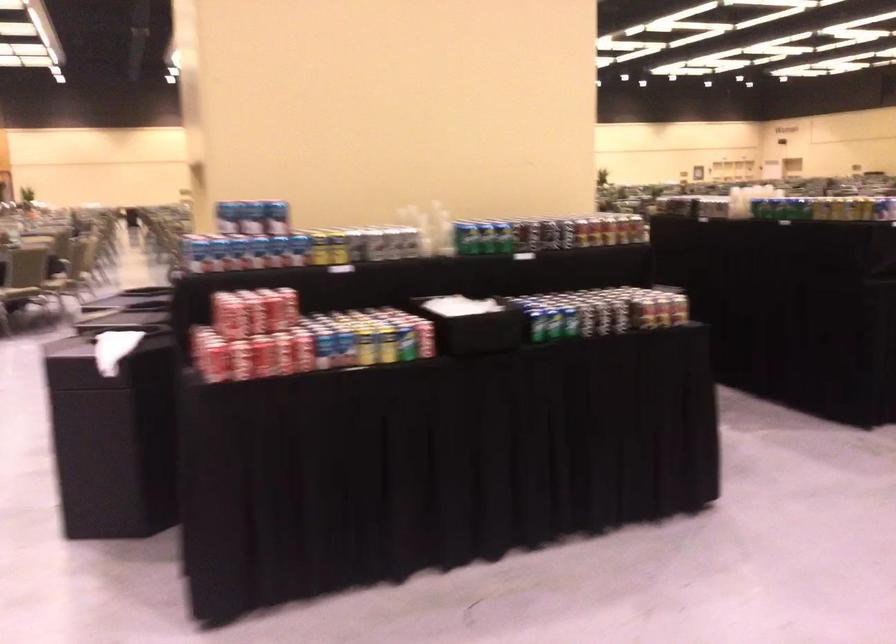
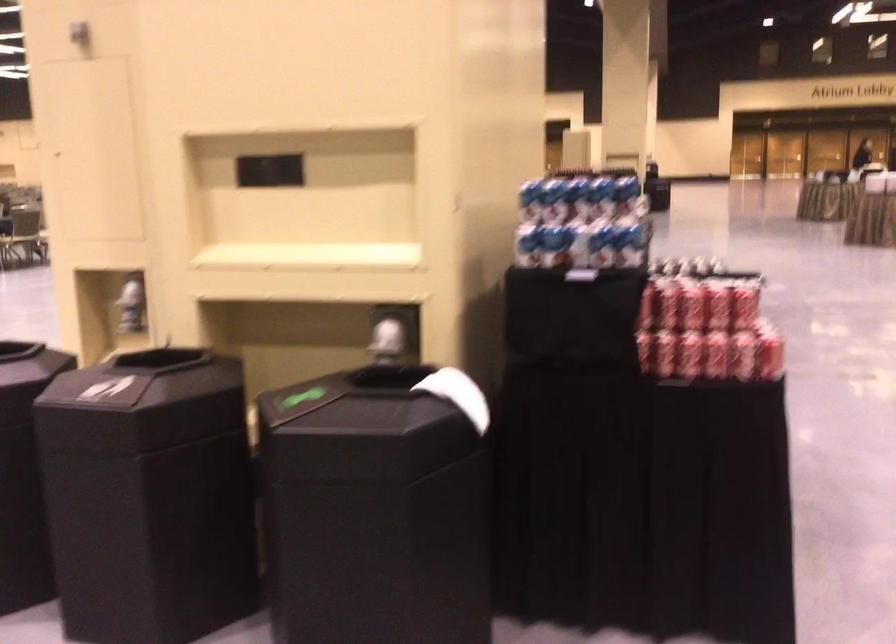
In the second image, find the point that corresponds to [188,249] in the first image.

(553, 245)